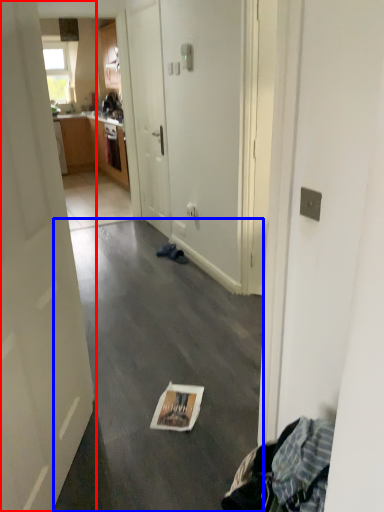
Question: Which of the following is the closest to the observer, door (highlighted by a red box) or concrete (highlighted by a blue box)?

Choices:
 (A) door
 (B) concrete

Answer: (A)